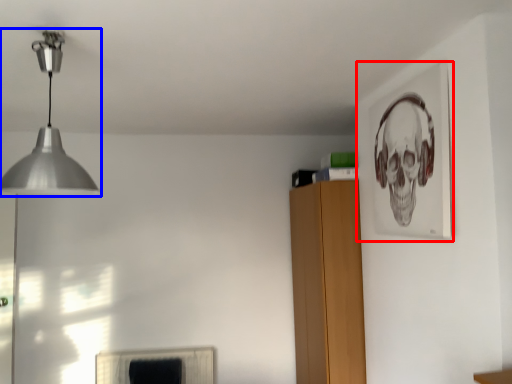
Question: Which of the following is the closest to the observer, picture frame (highlighted by a red box) or lamp (highlighted by a blue box)?

Choices:
 (A) picture frame
 (B) lamp

Answer: (B)